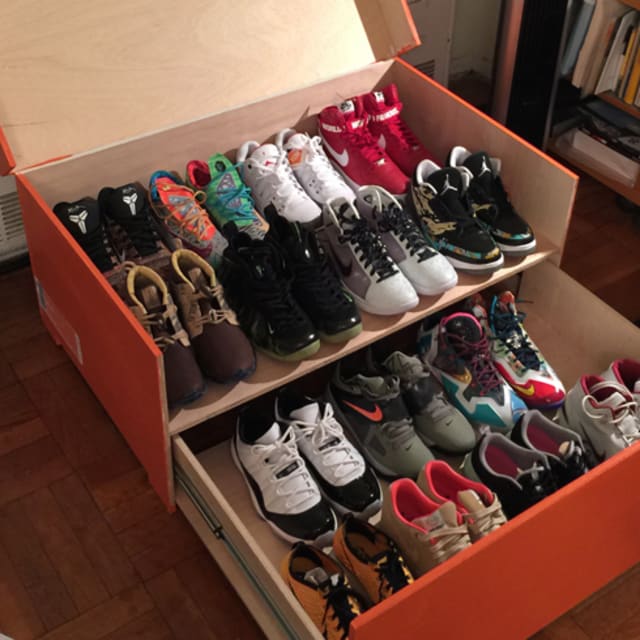
Find the location of `orange shoe box drawer front`. orange shoe box drawer front is located at coordinates (548, 578).